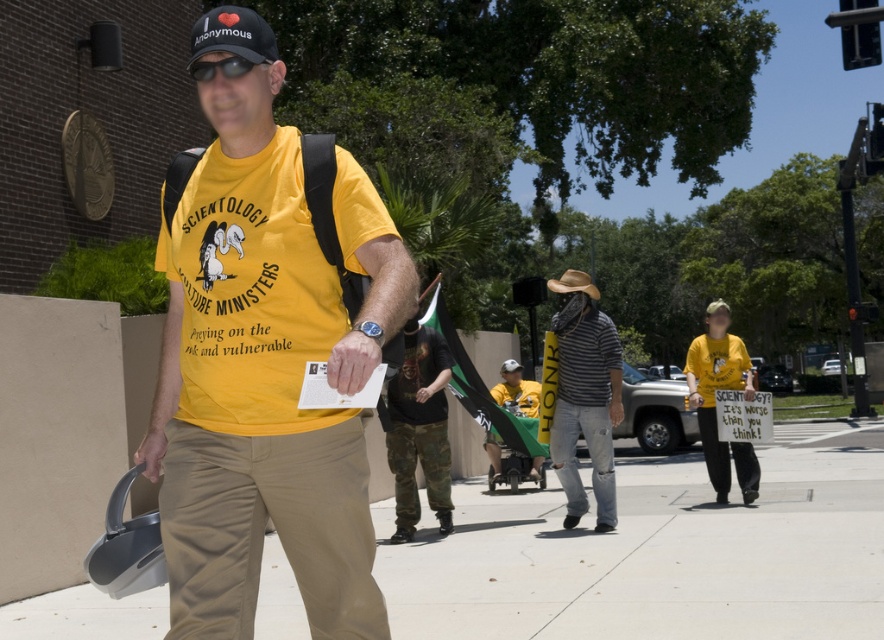
You are a delivery person who needs to place a 1.5 meter long package on the smooth concrete sidewalk at center. Considering the striped cotton shirt at center is currently occupying part of the sidewalk, can the package be placed entirely on the sidewalk without overlapping the shirt?

The smooth concrete sidewalk at center is wider than the striped cotton shirt at center, so the 1.5 meter package can be placed entirely on the sidewalk without overlapping the shirt as long as it is positioned to avoid the shirt.

You are a photographer taking a picture of the protest scene. You notice two points in the image labeled as point 1 at coordinates point (113, 634) and point 2 at coordinates point (615, 397). Which point will appear larger in your photo?

Point 1 at coordinates point (113, 634) will appear larger in the photo because it is closer to the camera than point 2 at coordinates point (615, 397).